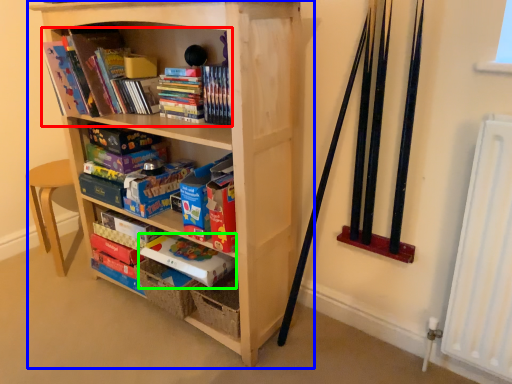
Question: Which object is the closest to the book (highlighted by a red box)? Choose among these: bookcase (highlighted by a blue box) or paperback book (highlighted by a green box).

Choices:
 (A) bookcase
 (B) paperback book

Answer: (A)